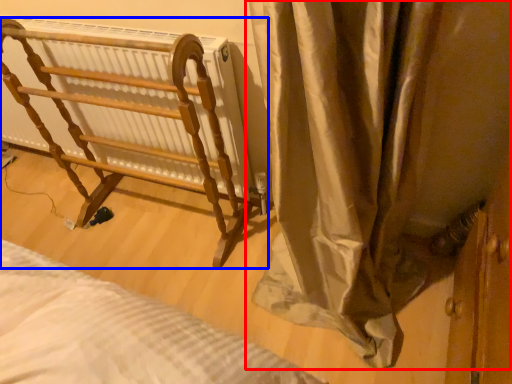
Question: Which of the following is the closest to the observer, curtain (highlighted by a red box) or furniture (highlighted by a blue box)?

Choices:
 (A) curtain
 (B) furniture

Answer: (A)